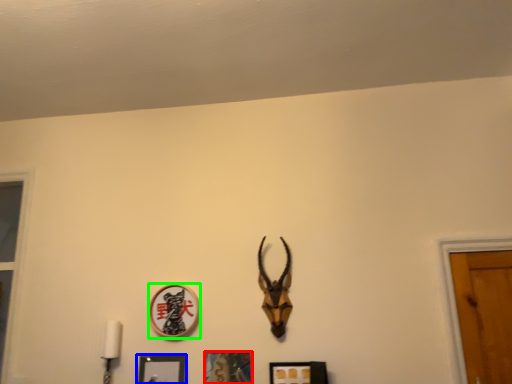
Question: Estimate the real-world distances between objects in this image. Which object is farther from picture frame (highlighted by a red box), picture frame (highlighted by a blue box) or picture frame (highlighted by a green box)?

Choices:
 (A) picture frame
 (B) picture frame

Answer: (B)